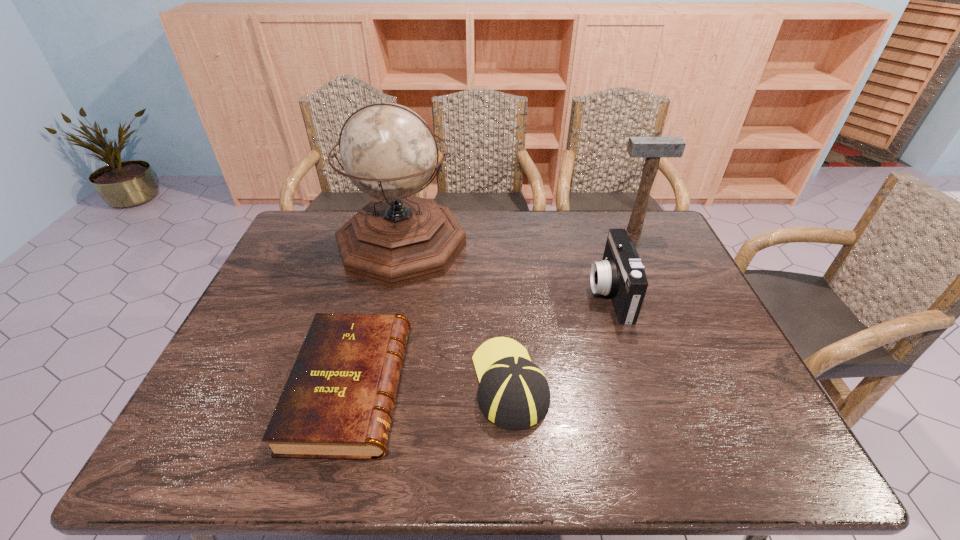
The height and width of the screenshot is (540, 960). Find the location of `empty space that is in between the baseball cap and the third shortest object`. empty space that is in between the baseball cap and the third shortest object is located at coordinates (560, 338).

Locate an element on the screen. The image size is (960, 540). vacant space that is in between the rightmost object and the tallest object is located at coordinates (517, 238).

Where is `vacant space in between the fourth object from left to right and the tallest object`? vacant space in between the fourth object from left to right and the tallest object is located at coordinates (506, 269).

You are a GUI agent. You are given a task and a screenshot of the screen. Output one action in this format:
    pyautogui.click(x=<x>, y=<y>)
    Task: Click on the vacant area between the second object from right to left and the globe
    
    Given the screenshot: What is the action you would take?
    pyautogui.click(x=506, y=269)

Identify the location of free spot between the globe and the rightmost object. (517, 238).

The image size is (960, 540). Find the location of `vacant area that lies between the rightmost object and the tallest object`. vacant area that lies between the rightmost object and the tallest object is located at coordinates (517, 238).

The height and width of the screenshot is (540, 960). Find the location of `free space between the rightmost object and the tallest object`. free space between the rightmost object and the tallest object is located at coordinates (517, 238).

The image size is (960, 540). Find the location of `vacant area that lies between the baseball cap and the third tallest object`. vacant area that lies between the baseball cap and the third tallest object is located at coordinates [560, 338].

The height and width of the screenshot is (540, 960). What are the coordinates of `free area in between the baseball cap and the globe` in the screenshot? It's located at (456, 314).

Identify which object is located as the nearest to the fourth tallest object. Please provide its 2D coordinates. Your answer should be formatted as a tuple, i.e. [(x, y)], where the tuple contains the x and y coordinates of a point satisfying the conditions above.

[(337, 403)]